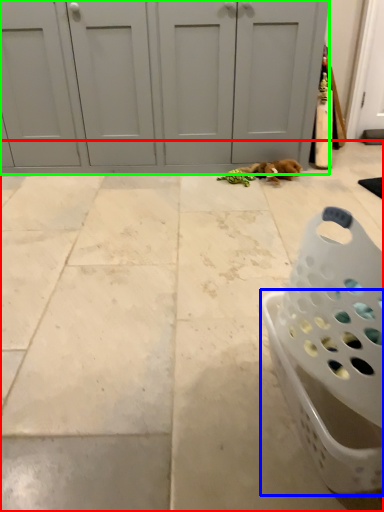
Question: Which object is positioned closest to concrete (highlighted by a red box)? Select from basket (highlighted by a blue box) and door (highlighted by a green box).

Choices:
 (A) basket
 (B) door

Answer: (A)